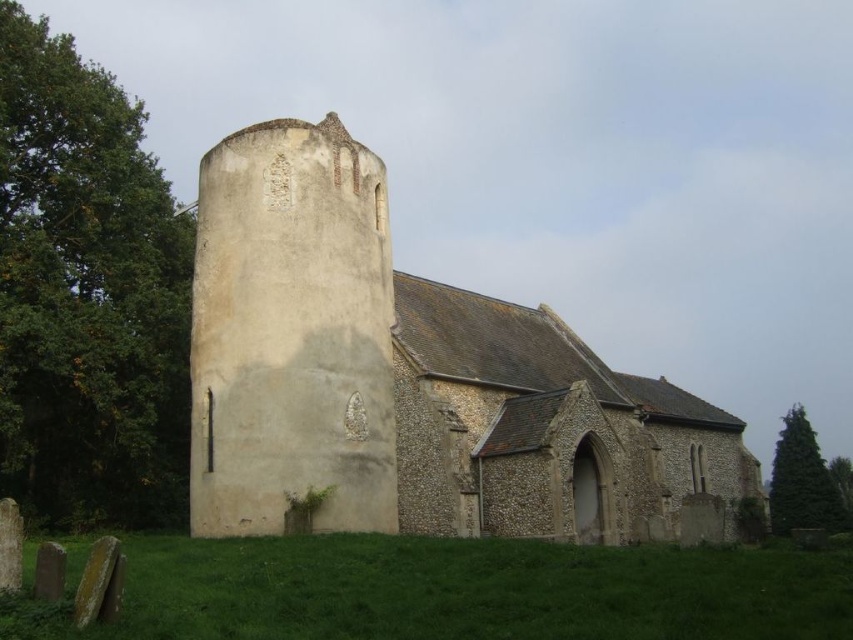
Question: Can you confirm if beige stone church at center is bigger than green grass at lower center?

Choices:
 (A) no
 (B) yes

Answer: (B)

Question: Where is beige stone church at center located in relation to green grass at lower center in the image?

Choices:
 (A) above
 (B) below

Answer: (A)

Question: Can you confirm if beige stone church at center is positioned below green grass at lower center?

Choices:
 (A) no
 (B) yes

Answer: (A)

Question: Among these points, which one is farthest from the camera?

Choices:
 (A) (624, 598)
 (B) (280, 326)

Answer: (B)

Question: Which object appears farthest from the camera in this image?

Choices:
 (A) beige stone church at center
 (B) green grass at lower center

Answer: (A)

Question: Which object appears farthest from the camera in this image?

Choices:
 (A) green grass at lower center
 (B) beige stone church at center

Answer: (B)